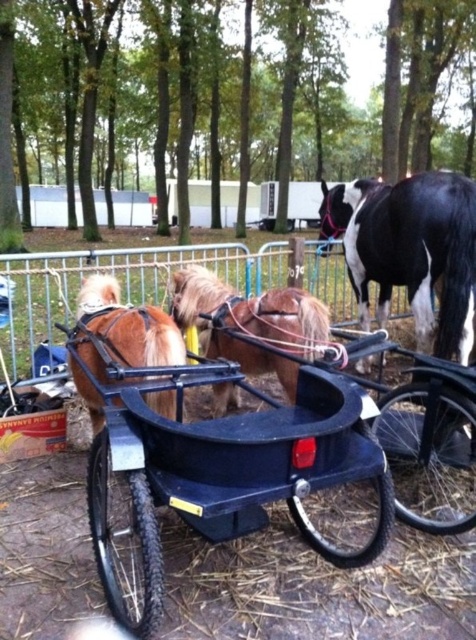
Question: In this image, where is black plastic cart at center located relative to brown glossy horse at center?

Choices:
 (A) right
 (B) left

Answer: (A)

Question: In this image, where is black and white textured horse at center located relative to shiny brown pony at center?

Choices:
 (A) below
 (B) above

Answer: (B)

Question: Which object is the closest to the brown glossy horse at center?

Choices:
 (A) black and white textured horse at center
 (B) black plastic cart at center

Answer: (B)

Question: Is shiny brown pony at center thinner than brown glossy horse at center?

Choices:
 (A) yes
 (B) no

Answer: (B)

Question: Which point appears closest to the camera in this image?

Choices:
 (A) (95, 419)
 (B) (259, 352)
 (C) (472, 237)
 (D) (168, 384)

Answer: (D)

Question: Among these points, which one is farthest from the camera?

Choices:
 (A) (130, 378)
 (B) (472, 273)

Answer: (B)